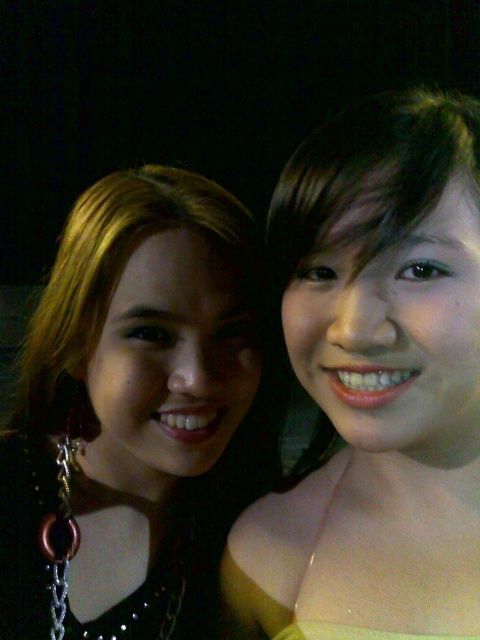
Question: Which object appears closest to the camera in this image?

Choices:
 (A) matte black hair at left
 (B) matte yellow dress at center

Answer: (B)

Question: Which point is farther to the camera?

Choices:
 (A) matte yellow dress at center
 (B) matte black hair at left

Answer: (B)

Question: From the image, what is the correct spatial relationship of matte yellow dress at center in relation to matte black hair at left?

Choices:
 (A) right
 (B) left

Answer: (A)

Question: From the image, what is the correct spatial relationship of matte yellow dress at center in relation to matte black hair at left?

Choices:
 (A) below
 (B) above

Answer: (B)

Question: Where is matte yellow dress at center located in relation to matte black hair at left in the image?

Choices:
 (A) above
 (B) below

Answer: (A)